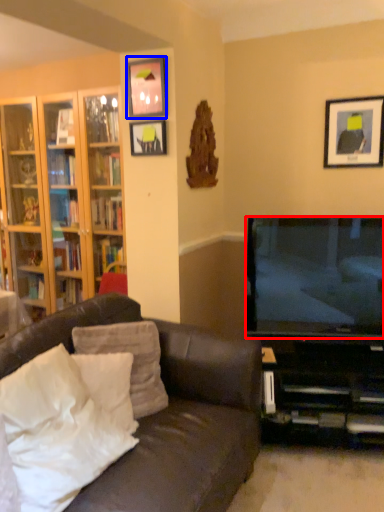
Question: Which of the following is the closest to the observer, television (highlighted by a red box) or picture frame (highlighted by a blue box)?

Choices:
 (A) television
 (B) picture frame

Answer: (A)